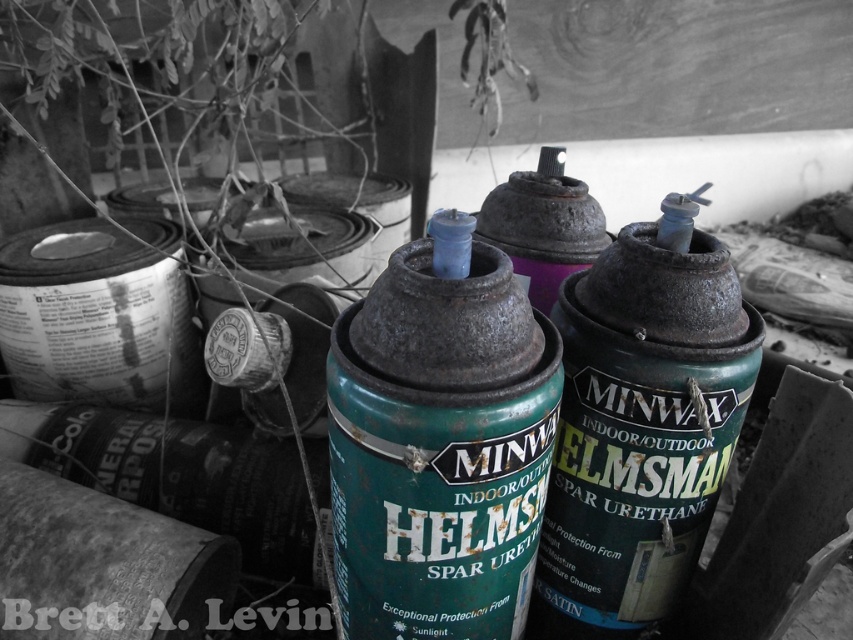
Question: Which of the following is the closest to the observer?

Choices:
 (A) green matte spray can at center
 (B) rusty green paint can at center

Answer: (B)

Question: Where is rusty green paint can at center located in relation to green matte spray can at center in the image?

Choices:
 (A) left
 (B) right

Answer: (A)

Question: From the image, what is the correct spatial relationship of rusty green paint can at center in relation to green matte spray can at center?

Choices:
 (A) below
 (B) above

Answer: (B)

Question: Does rusty green paint can at center appear on the left side of green matte spray can at center?

Choices:
 (A) no
 (B) yes

Answer: (B)